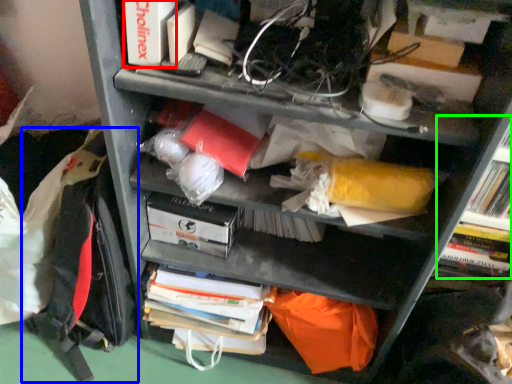
Question: Considering the real-world distances, which object is closest to paperback book (highlighted by a red box)? backpack (highlighted by a blue box) or shelf (highlighted by a green box).

Choices:
 (A) backpack
 (B) shelf

Answer: (A)